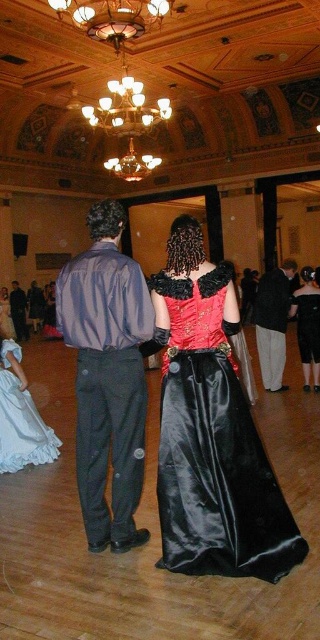
Is point (193, 368) positioned in front of point (13, 321)?

Yes, point (193, 368) is closer to viewer.

Can you confirm if shiny satin dress at center is positioned below silky blue shirt at center?

Yes.

Which is in front, point (213, 467) or point (21, 291)?

Positioned in front is point (213, 467).

The width and height of the screenshot is (320, 640). Identify the location of shiny satin dress at center. (214, 449).

Can you confirm if shiny satin dress at center is smaller than black satin dress at lower right?

No.

Is shiny satin dress at center below black satin dress at lower right?

Indeed, shiny satin dress at center is positioned under black satin dress at lower right.

Where is `shiny satin dress at center`? Image resolution: width=320 pixels, height=640 pixels. shiny satin dress at center is located at coordinates (214, 449).

Where is `shiny satin dress at center`? shiny satin dress at center is located at coordinates click(x=214, y=449).

Based on the photo, who is higher up, shiny satin dress at center or dark gray pants at right?

dark gray pants at right

Between shiny satin dress at center and dark gray pants at right, which one appears on the right side from the viewer's perspective?

dark gray pants at right

Image resolution: width=320 pixels, height=640 pixels. In order to click on shiny satin dress at center in this screenshot , I will do `click(214, 449)`.